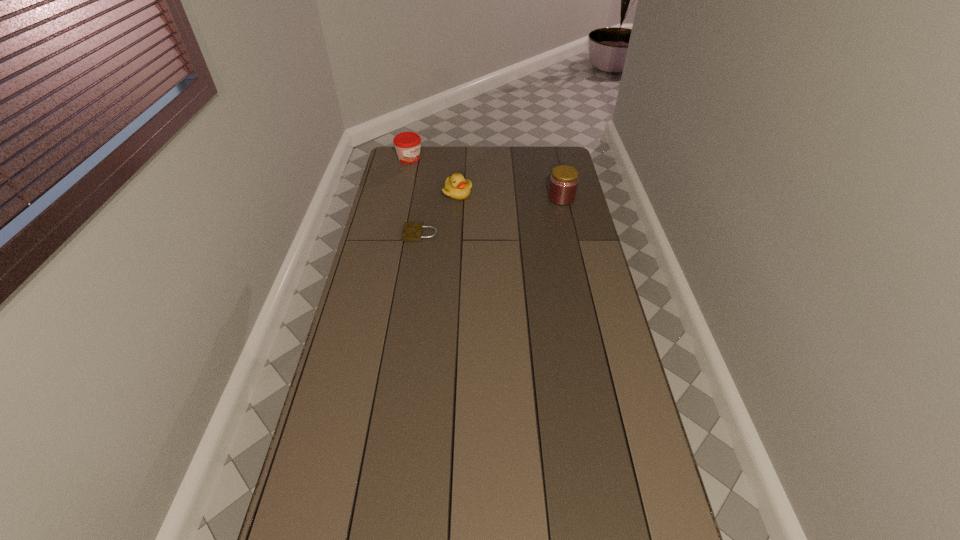
Find the location of a particular element. free region at the left edge of the desktop is located at coordinates point(392,264).

This screenshot has height=540, width=960. Identify the location of free space at the right edge of the desktop. (597, 391).

This screenshot has height=540, width=960. In the image, there is a desktop. What are the coordinates of `vacant region at the far right corner` in the screenshot? It's located at [x=553, y=162].

Identify the location of vacant space at the near right corner. (606, 509).

Locate an element on the screen. The width and height of the screenshot is (960, 540). vacant point located between the right jam and the shorter jam is located at coordinates (486, 178).

Identify the location of free space that is in between the duckling and the nearer jam. The height and width of the screenshot is (540, 960). (510, 195).

The height and width of the screenshot is (540, 960). In order to click on free space that is in between the farther jam and the taller jam in this screenshot , I will do `click(486, 178)`.

Where is `empty space between the third object from left to right and the farther jam`? empty space between the third object from left to right and the farther jam is located at coordinates (434, 176).

I want to click on free space between the farthest object and the shortest object, so click(x=415, y=196).

The image size is (960, 540). Identify the location of vacant space that's between the tallest object and the farther jam. (486, 178).